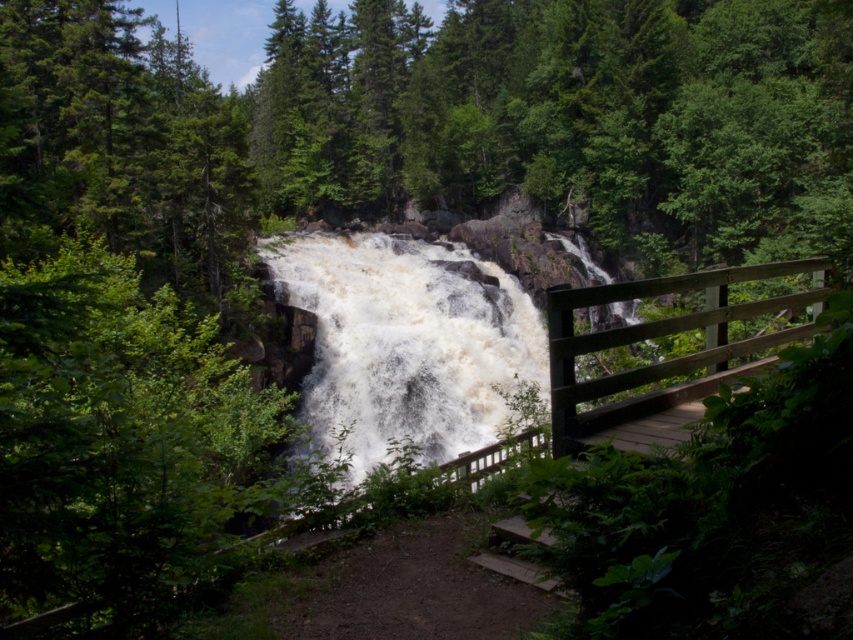
You are a photographer standing on the wooden bridge trying to capture the white frothy water at center without the brown wooden rail at center right appearing in the foreground. Is this possible based on their positions?

The brown wooden rail at center right is behind the white frothy water at center, so yes, the photographer can capture the white frothy water at center without the rail appearing in the foreground since the rail is positioned behind the water.

You are standing at the wooden bridge and want to reach the waterfall. There are two points marked on the path ahead of you. The first is point (453, 417) and the second is point (556, 426). Which point is closer to the waterfall?

Point (453, 417) is behind point (556, 426), so the closer point to the waterfall is point (556, 426).

You are standing on the wooden bridge and want to take a photo of the white frothy water at center and the brown wooden rail at center right. Which object should you aim your camera towards first if you want to capture both in one shot?

You should aim your camera towards the white frothy water at center first because it is located to the left of the brown wooden rail at center right, so capturing the left side first will include both objects in the frame.